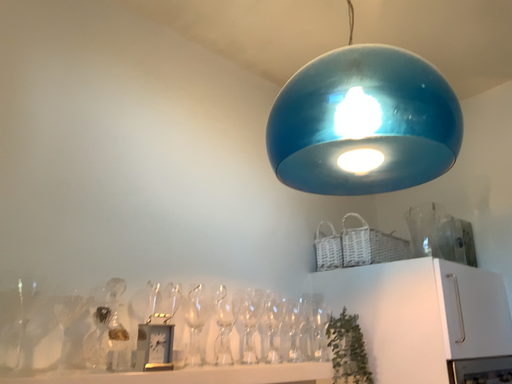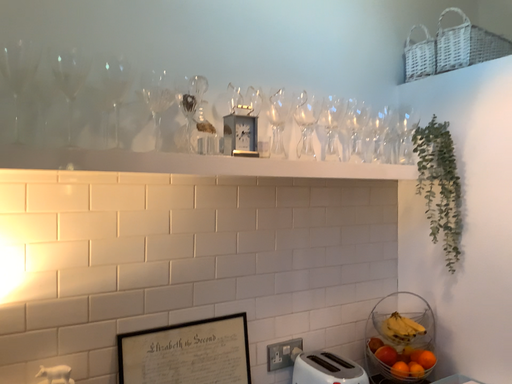
Question: How did the camera likely rotate when shooting the video?

Choices:
 (A) rotated right
 (B) rotated left

Answer: (B)